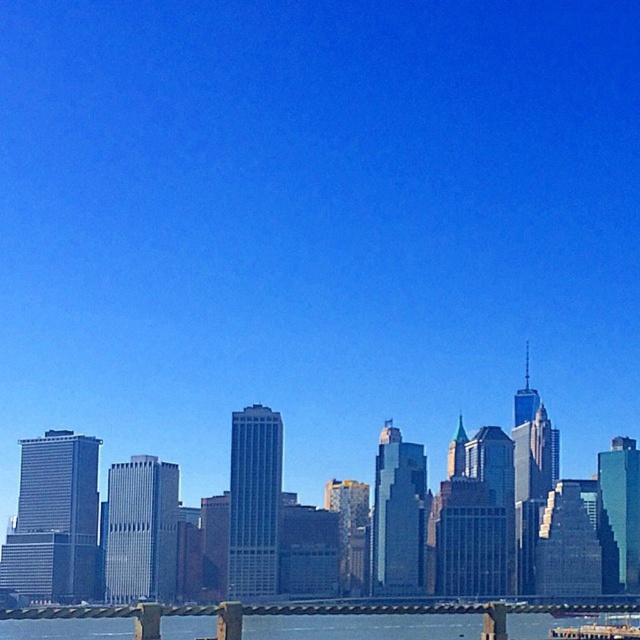
Measure the distance between point [436,604] and camera.

They are 2174.16 feet apart.

Does clear water at lower center appear over metallic ferry at lower center?

Indeed, clear water at lower center is positioned over metallic ferry at lower center.

Which is behind, point (492, 609) or point (616, 632)?

Positioned behind is point (616, 632).

Identify the location of clear water at lower center. Image resolution: width=640 pixels, height=640 pixels. (307, 612).